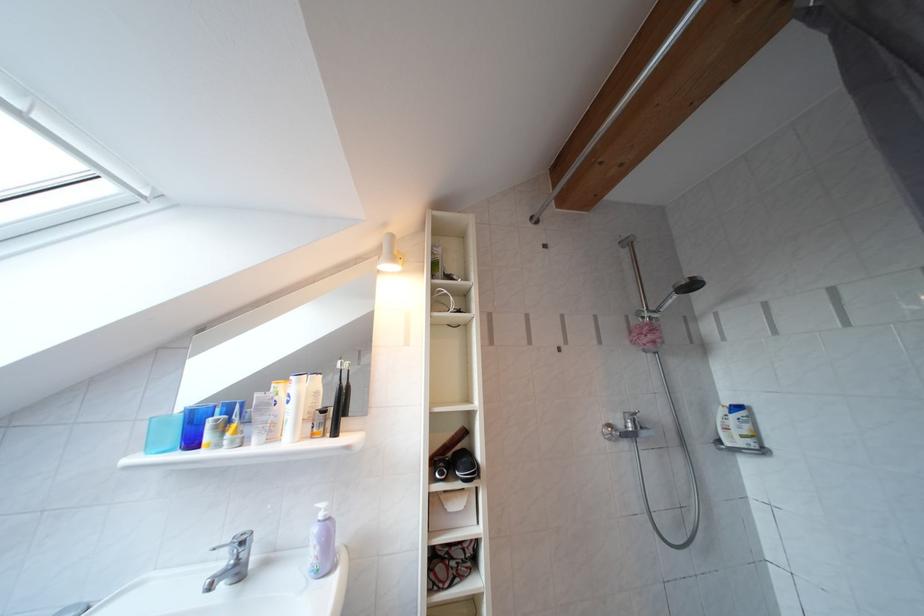
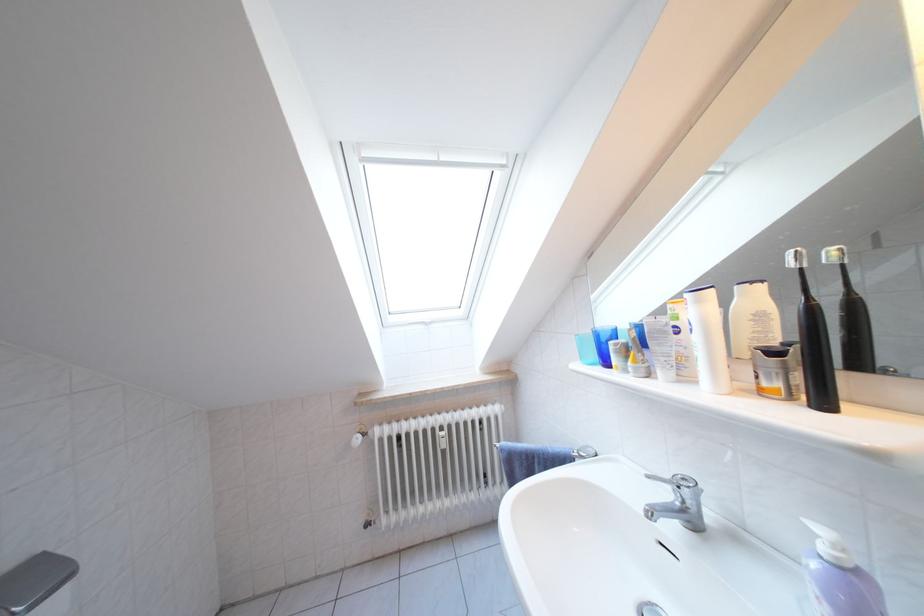
Find the pixel in the second image that matches point 307,387 in the first image.

(708, 306)